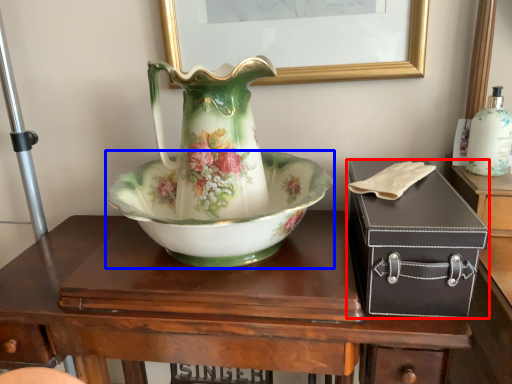
Question: Which point is closer to the camera, box (highlighted by a red box) or bowl (highlighted by a blue box)?

Choices:
 (A) box
 (B) bowl

Answer: (A)